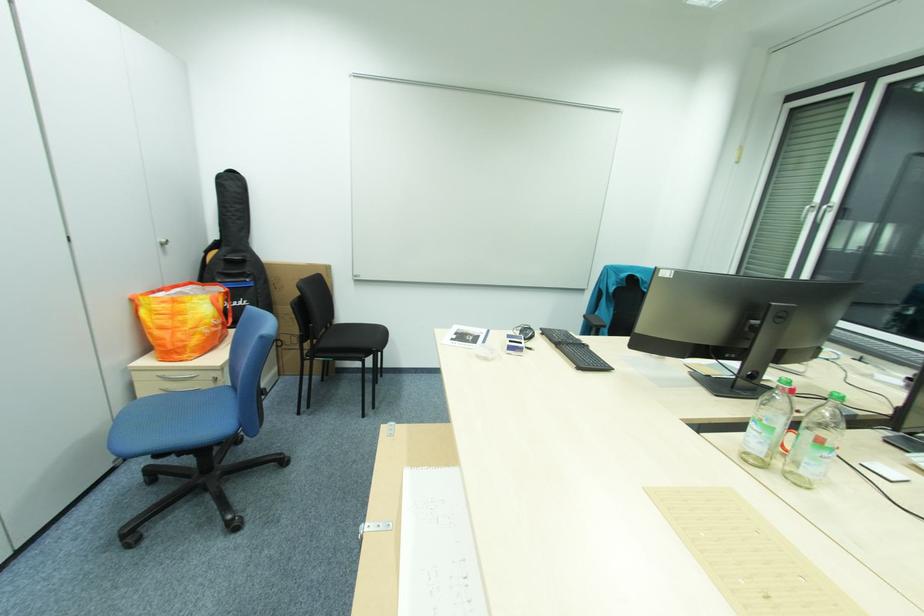
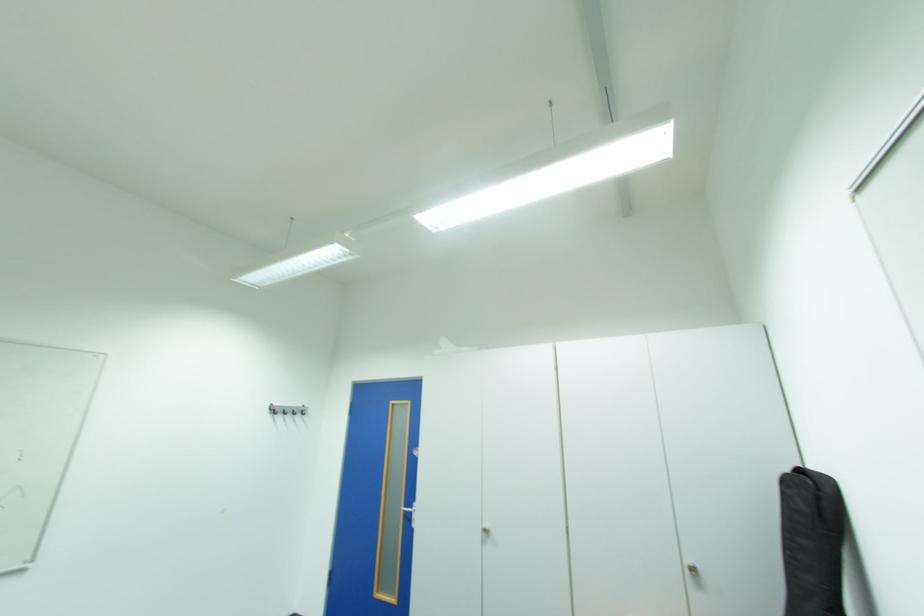
In the second image, find the point that corresponds to [227,177] in the first image.

(795, 482)